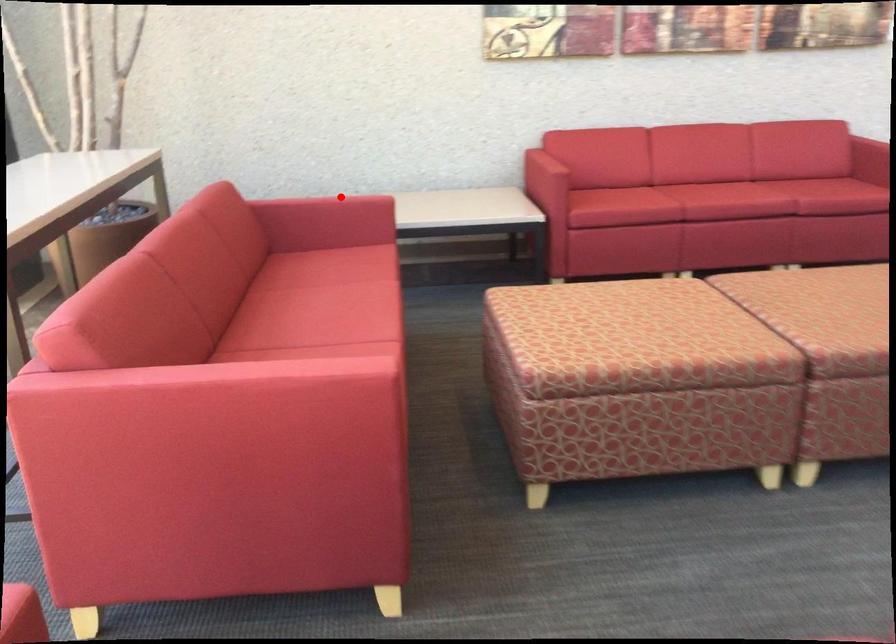
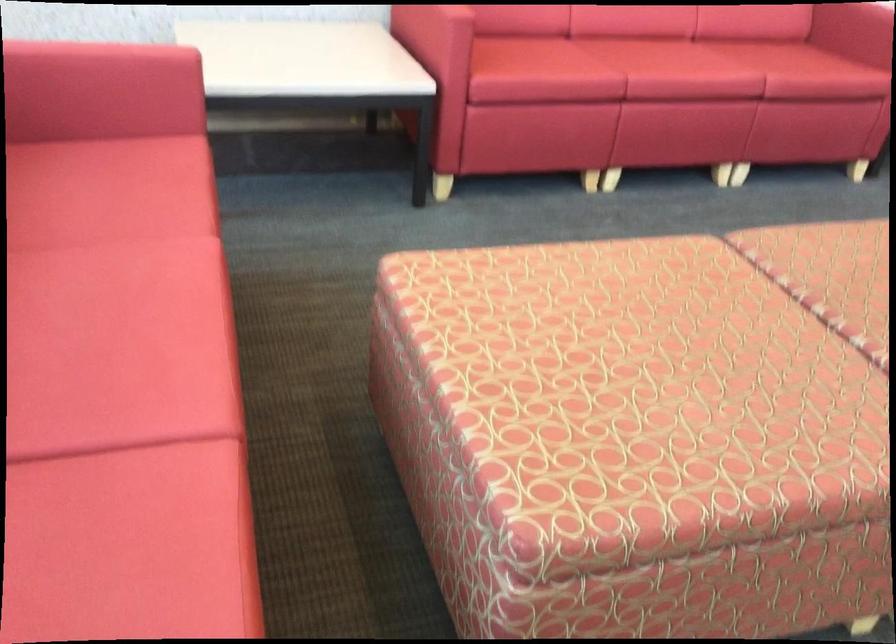
Where in the second image is the point corresponding to the highlighted location from the first image?

(102, 53)